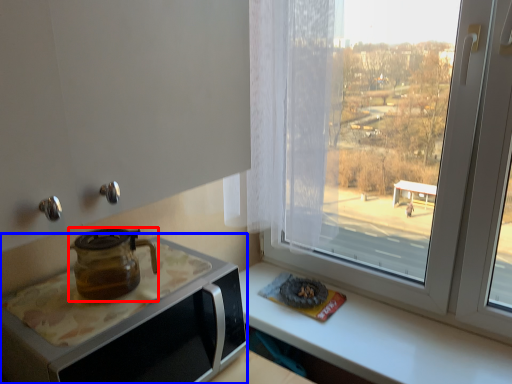
Question: Which object appears farthest to the camera in this image, kitchen appliance (highlighted by a red box) or appliance (highlighted by a blue box)?

Choices:
 (A) kitchen appliance
 (B) appliance

Answer: (A)